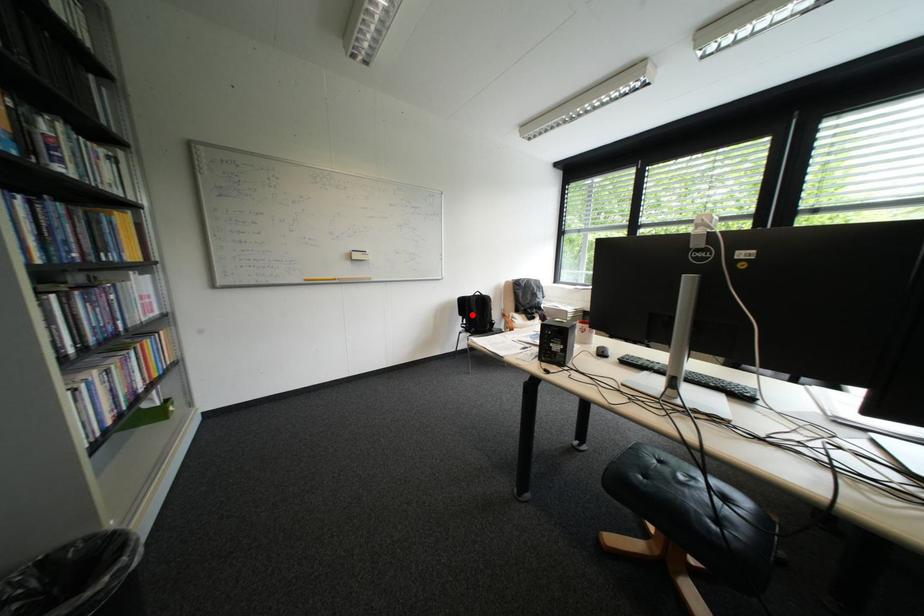
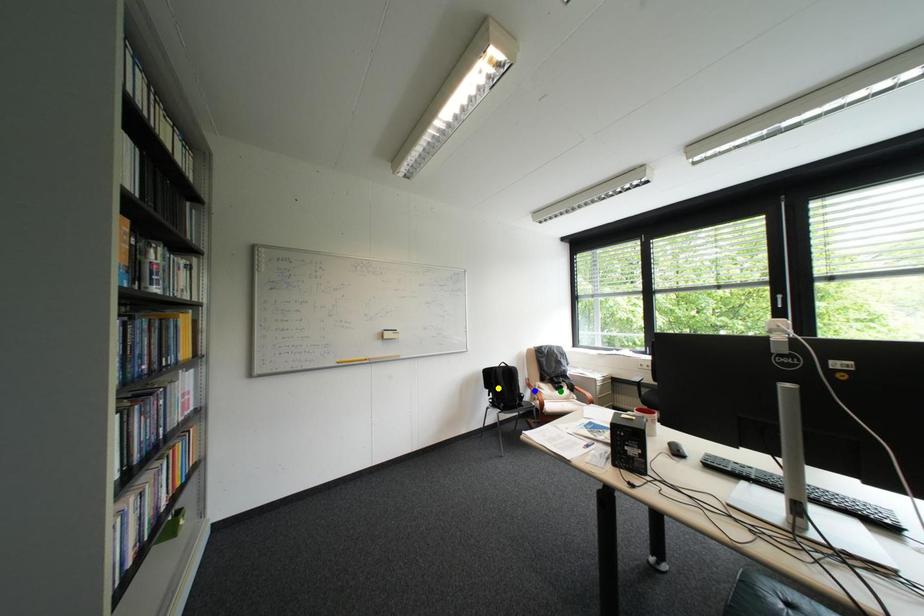
Question: I am providing you with two images of the same scene from different viewpoints. A red point is marked on the first image. You are given multiple points on the second image. Which spot in image 2 lines up with the point in image 1?

Choices:
 (A) blue point
 (B) yellow point
 (C) green point

Answer: (B)